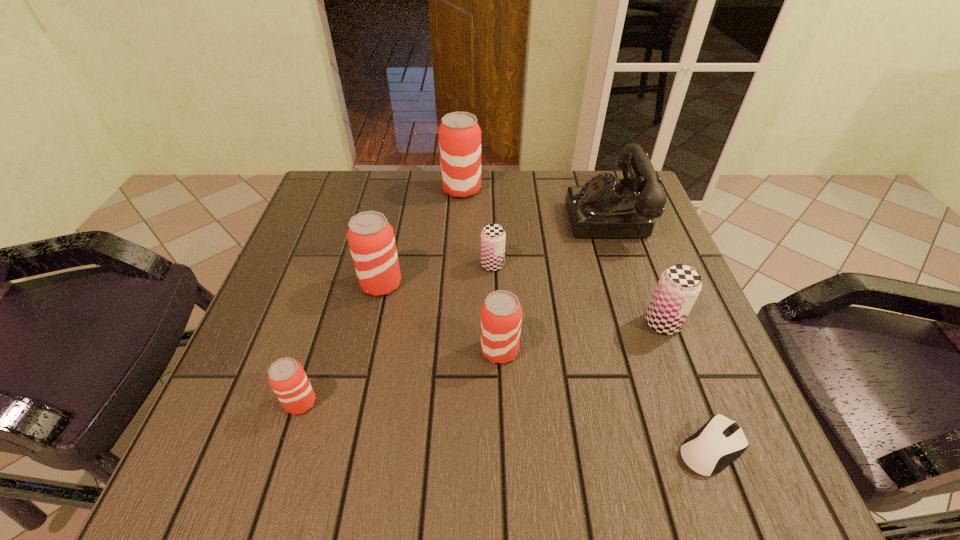
You are a GUI agent. You are given a task and a screenshot of the screen. Output one action in this format:
    pyautogui.click(x=<x>, y=<y>)
    Task: Click on the leftmost beer can
    The image size is (960, 540).
    Given the screenshot: What is the action you would take?
    pyautogui.click(x=287, y=378)

At what (x,y) coordinates should I click in order to perform the action: click on the nearest beer can. Please return your answer as a coordinate pair (x, y). The image size is (960, 540). Looking at the image, I should click on (287, 378).

Image resolution: width=960 pixels, height=540 pixels. I want to click on the nearest object, so pyautogui.click(x=720, y=441).

Locate an element on the screen. Image resolution: width=960 pixels, height=540 pixels. white mouse is located at coordinates (720, 441).

You are a GUI agent. You are given a task and a screenshot of the screen. Output one action in this format:
    pyautogui.click(x=<x>, y=<y>)
    Task: Click on the blank space located 0.320m on the left of the farthest beer can
    The width and height of the screenshot is (960, 540).
    Given the screenshot: What is the action you would take?
    point(324,190)

Identify the location of free space located 0.070m on the dial of the telephone. The image size is (960, 540). (539, 217).

Where is `vacant space located on the dial of the telephone`? The image size is (960, 540). vacant space located on the dial of the telephone is located at coordinates (407, 217).

Where is `free point located on the dial of the telephone`? The width and height of the screenshot is (960, 540). free point located on the dial of the telephone is located at coordinates (423, 217).

Where is `free region located 0.280m on the back of the second biggest orange beer can`? The height and width of the screenshot is (540, 960). free region located 0.280m on the back of the second biggest orange beer can is located at coordinates (400, 196).

You are a GUI agent. You are given a task and a screenshot of the screen. Output one action in this format:
    pyautogui.click(x=<x>, y=<y>)
    Task: Click on the free region located 0.110m on the left of the third biggest orange beer can
    
    Given the screenshot: What is the action you would take?
    pyautogui.click(x=421, y=350)